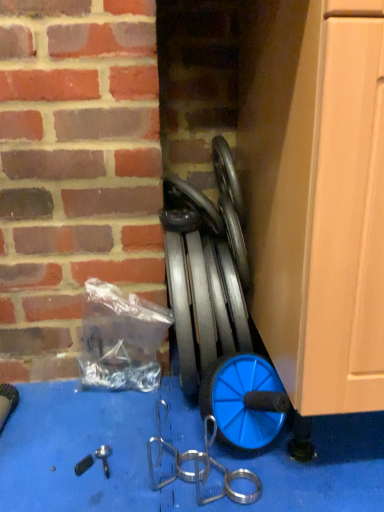
Question: From a real-world perspective, is blue rubber hose at center physically located above or below blue rubber wheel at center?

Choices:
 (A) above
 (B) below

Answer: (B)

Question: Is point (225, 285) closer or farther from the camera than point (206, 202)?

Choices:
 (A) closer
 (B) farther

Answer: (A)

Question: Which object is the farthest from the transparent plastic bag at center-left?

Choices:
 (A) blue rubber hose at center
 (B) blue rubber wheel at center

Answer: (B)

Question: Which object is positioned closest to the blue rubber hose at center?

Choices:
 (A) transparent plastic bag at center-left
 (B) blue rubber wheel at center

Answer: (B)